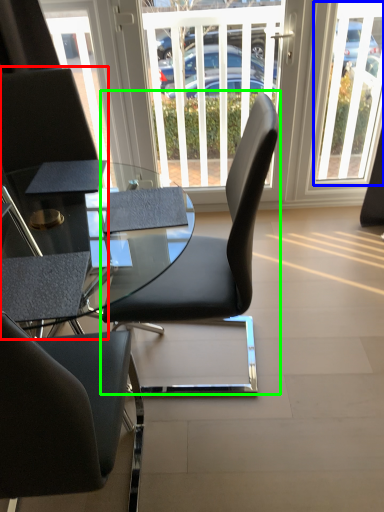
Question: Considering the real-world distances, which object is closest to chair (highlighted by a red box)? window (highlighted by a blue box) or chair (highlighted by a green box).

Choices:
 (A) window
 (B) chair

Answer: (B)